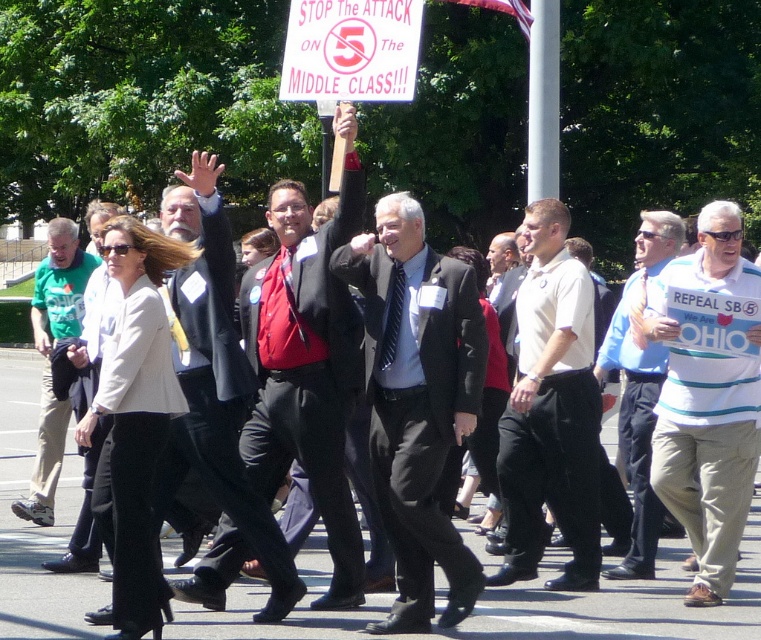
You are a photographer trying to capture a closeup shot of the shiny red tie at center and the blue striped shirt at center. Your camera can only focus on objects within a 1.5 meter range. Will both items be in focus?

The shiny red tie at center and blue striped shirt at center are 1.91 meters apart, which exceeds the camera focus range of 1.5 meters. Therefore, both items cannot be in focus simultaneously.

Based on the scene description, where is the white shirt at center located in terms of coordinates?

The white shirt at center is located at coordinates point (551, 410).